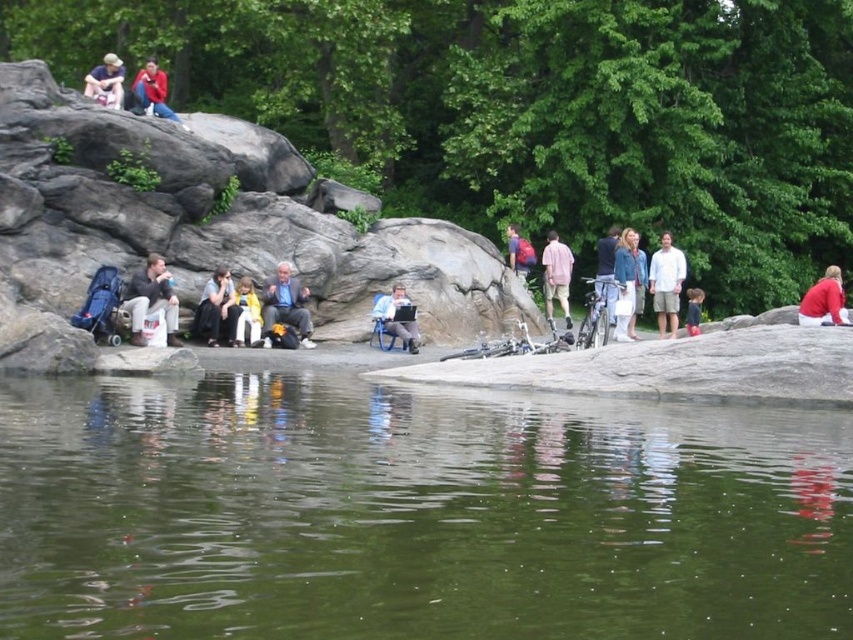
Which of these two, white cotton shirt at center or matte red jacket at upper left, stands taller?

Standing taller between the two is white cotton shirt at center.

Does point (664, 237) come farther from viewer compared to point (167, 109)?

Yes, point (664, 237) is behind point (167, 109).

This screenshot has width=853, height=640. What are the coordinates of `white cotton shirt at center` in the screenshot? It's located at (666, 284).

Does point (297, 332) lie behind point (697, 301)?

No.

Between matte gray jacket at center and light pink fabric dress at center, which one appears on the right side from the viewer's perspective?

Positioned to the right is light pink fabric dress at center.

Based on the photo, who is more forward, (300, 330) or (691, 296)?

Point (300, 330) is in front.

Where is `matte gray jacket at center`? This screenshot has width=853, height=640. matte gray jacket at center is located at coordinates (286, 304).

Who is positioned more to the right, gray rock at center or light pink fabric dress at center?

light pink fabric dress at center is more to the right.

How far apart are gray rock at center and light pink fabric dress at center?

The distance of gray rock at center from light pink fabric dress at center is 24.31 feet.

Is point (39, 81) positioned in front of point (691, 294)?

Yes, point (39, 81) is closer to viewer.

I want to click on gray rock at center, so click(x=219, y=218).